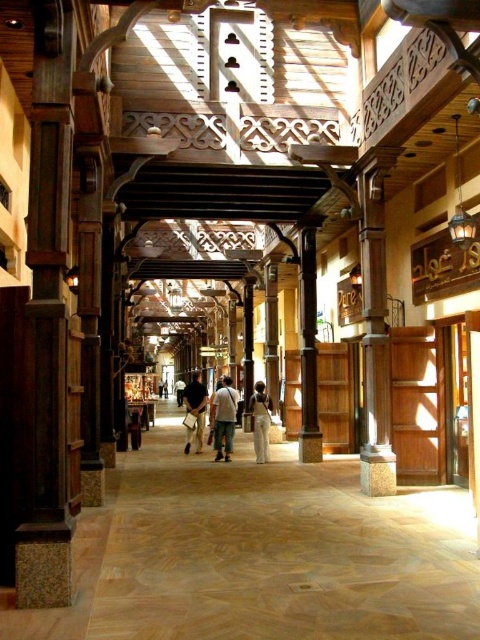
Question: Which of the following is the farthest from the observer?

Choices:
 (A) (261, 392)
 (B) (201, 412)
 (C) (384, 328)
 (D) (312, 444)

Answer: (B)

Question: Among these objects, which one is farthest from the camera?

Choices:
 (A) dark brown leather jacket at center
 (B) brown polished wood pillar at center
 (C) polished wood pillar at center

Answer: (A)

Question: Does brown polished wood pillar at center appear on the right side of light beige fabric pants at center?

Choices:
 (A) no
 (B) yes

Answer: (B)

Question: Where is polished wood pillar at center located in relation to light beige fabric pants at center in the image?

Choices:
 (A) below
 (B) above

Answer: (B)

Question: Can you confirm if light beige fabric pants at center is positioned to the right of dark brown leather jacket at center?

Choices:
 (A) no
 (B) yes

Answer: (B)

Question: Which point is farther from the camera taking this photo?

Choices:
 (A) (203, 384)
 (B) (220, 428)

Answer: (A)